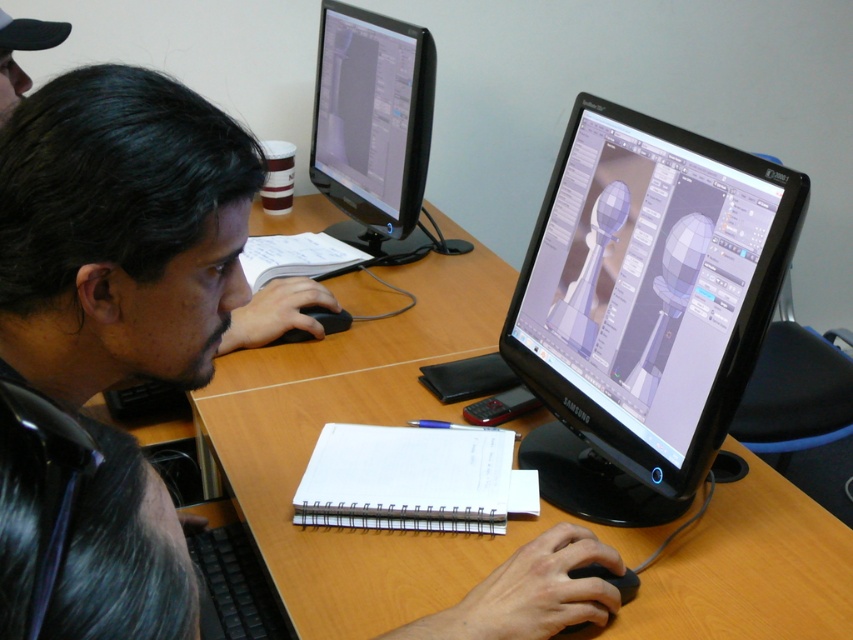
Question: Which object appears closest to the camera in this image?

Choices:
 (A) black matte laptop at upper left
 (B) black glossy monitor at center

Answer: (A)

Question: Is black glossy monitor at center further to camera compared to black matte laptop at upper left?

Choices:
 (A) no
 (B) yes

Answer: (B)

Question: Among these objects, which one is farthest from the camera?

Choices:
 (A) wooden desk at center
 (B) black plastic keyboard at lower left
 (C) black glossy monitor at center

Answer: (B)

Question: Does black matte laptop at upper left have a greater width compared to matte black monitor at upper left?

Choices:
 (A) no
 (B) yes

Answer: (A)

Question: From the image, what is the correct spatial relationship of black matte laptop at upper left in relation to matte black monitor at upper left?

Choices:
 (A) left
 (B) right

Answer: (A)

Question: Considering the real-world distances, which object is farthest from the black matte laptop at upper left?

Choices:
 (A) wooden desk at center
 (B) black glossy monitor at center
 (C) matte black monitor at upper left
 (D) black plastic keyboard at lower left

Answer: (C)